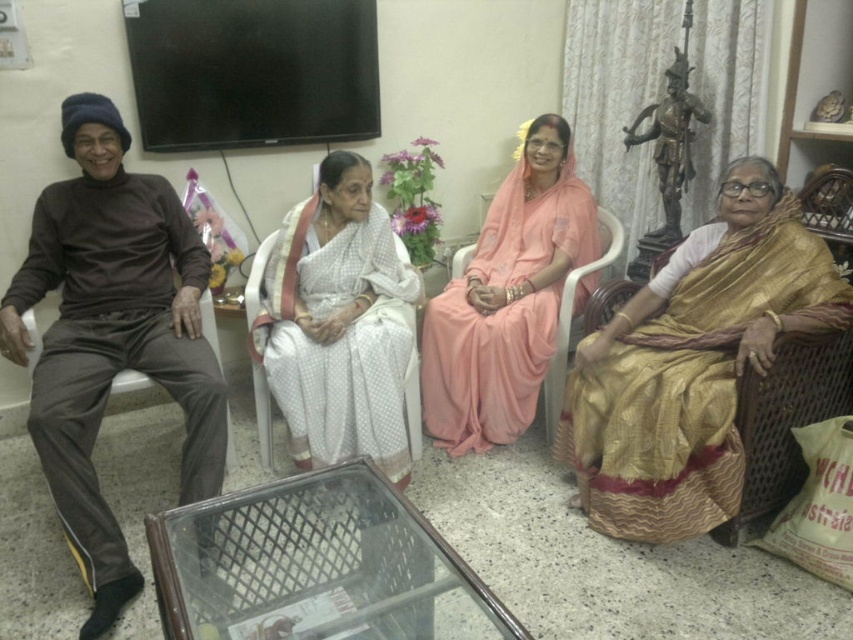
You are a photographer planning to take a group photo of the people in the scene. You need to ensure that the gold silk saree at right and the white silk saree at center are both visible in the frame. Given that your camera has a maximum horizontal field of view of 30 inches, can you capture both items in a single shot without moving the camera?

The gold silk saree at right is 33.16 inches from the white silk saree at center. Since the distance between them exceeds the camera field of view of 30 inches, you cannot capture both in a single shot without moving the camera.

You are a photographer setting up for a family portrait. You need to position the white silk saree at center and the brown fabric armchair at left in a way that the saree is visible above the armchair. Based on the scene description, is this arrangement already achieved?

Yes, the white silk saree at center is already positioned above the brown fabric armchair at left as described in the scene.

Based on the coordinates provided, which object corresponds to the point location at (339, 323)?

The point at (339, 323) corresponds to the white silk saree at center.